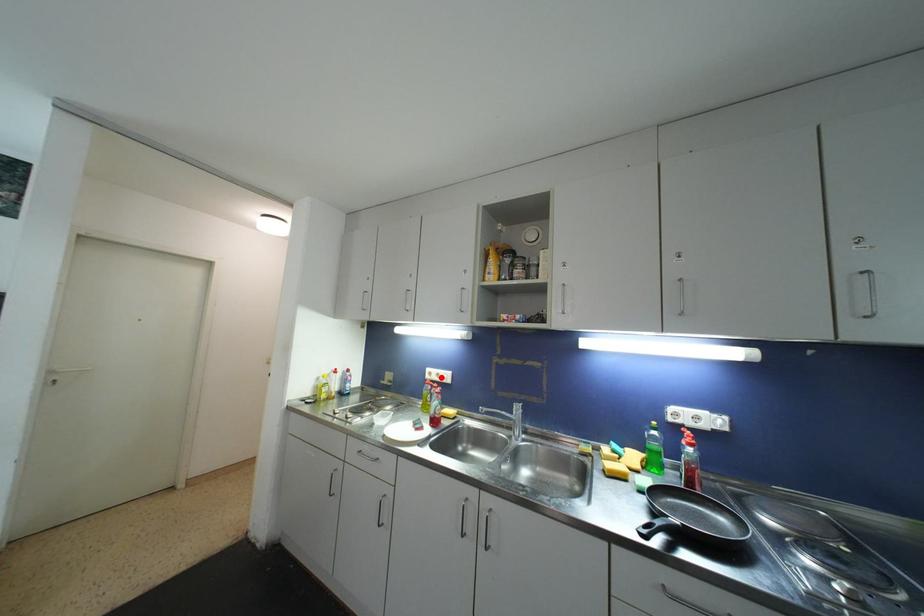
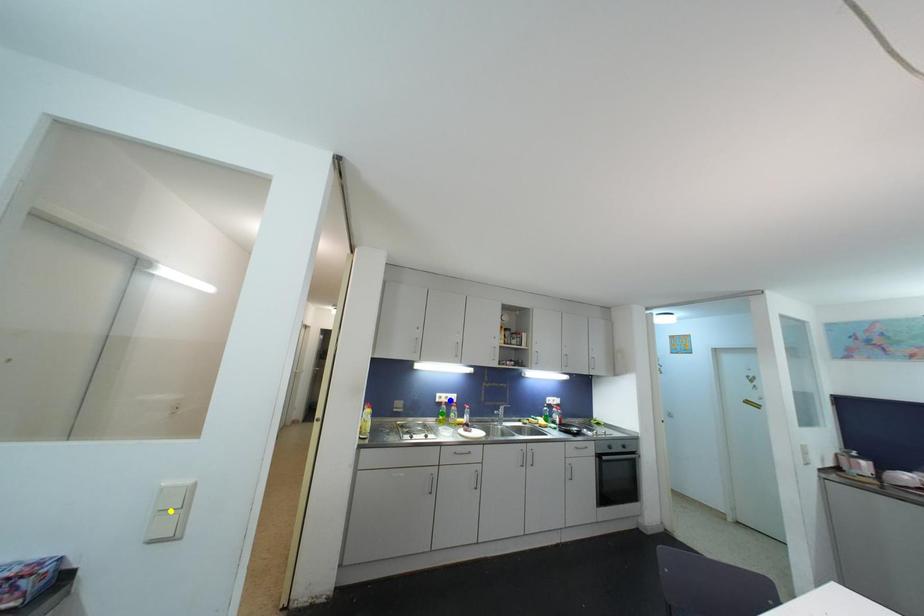
Question: I am providing you with two images of the same scene from different viewpoints. A red point is marked on the first image. You are given multiple points on the second image. Can you choose the point in image 2 that corresponds to the point in image 1?

Choices:
 (A) green point
 (B) blue point
 (C) yellow point

Answer: (B)